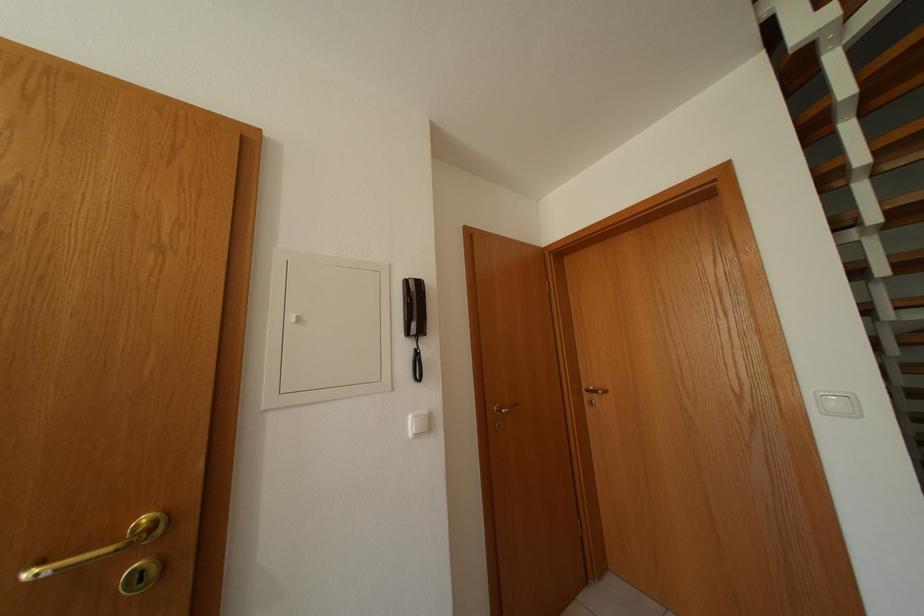
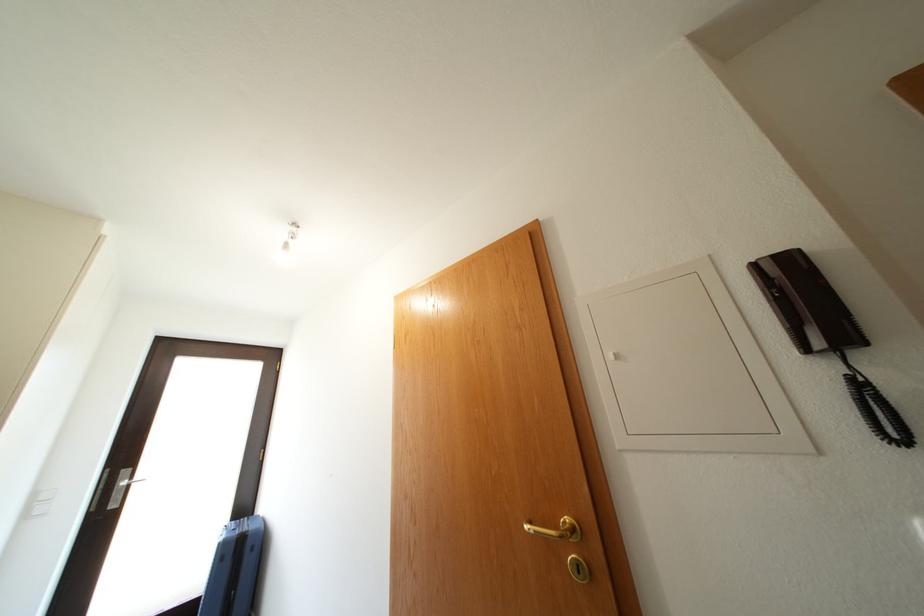
In the second image, find the point that corresponds to [37,580] in the first image.

(535, 533)